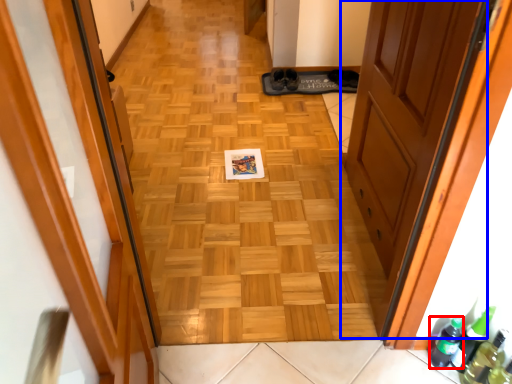
Question: Which object appears farthest to the camera in this image, beer bottle (highlighted by a red box) or door (highlighted by a blue box)?

Choices:
 (A) beer bottle
 (B) door

Answer: (A)